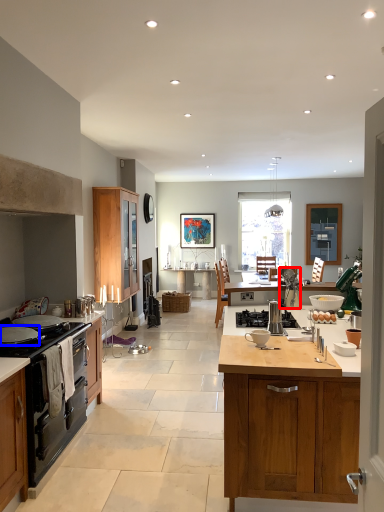
Question: Which point is closer to the camera, appliance (highlighted by a red box) or kitchen appliance (highlighted by a blue box)?

Choices:
 (A) appliance
 (B) kitchen appliance

Answer: (B)